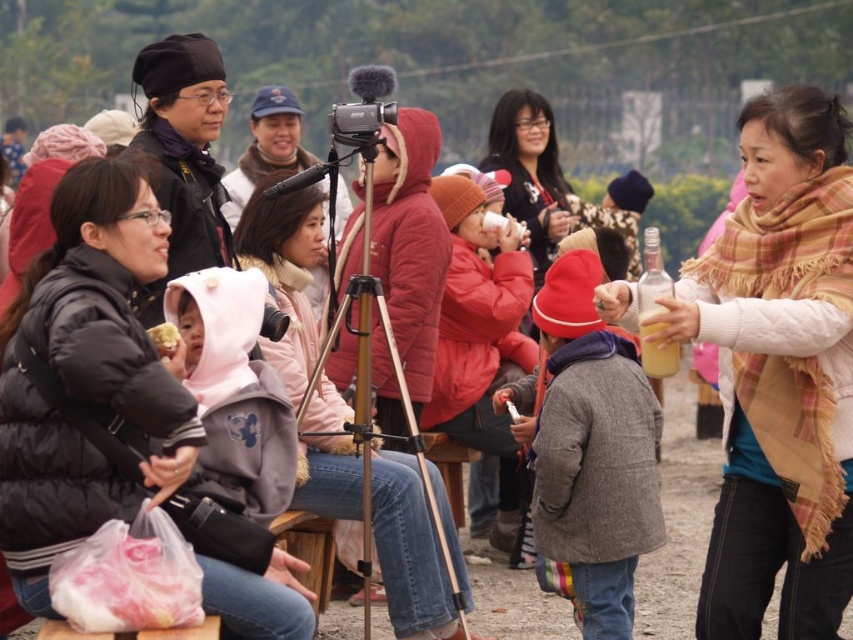
Question: Considering the real-world distances, which object is farthest from the black puffy jacket at left?

Choices:
 (A) black matte tripod at center
 (B) yellow matte cake at center
 (C) black matte video camera at center
 (D) plaid scarf at center

Answer: (D)

Question: Which object appears farthest from the camera in this image?

Choices:
 (A) black matte tripod at center
 (B) black puffy jacket at left
 (C) black matte video camera at center

Answer: (A)

Question: Observing the image, what is the correct spatial positioning of black matte video camera at center in reference to yellow matte cake at center?

Choices:
 (A) below
 (B) above

Answer: (B)

Question: Which point appears closest to the camera in this image?

Choices:
 (A) [165, 323]
 (B) [848, 477]
 (C) [379, 173]
 (D) [245, 570]

Answer: (D)

Question: Is plaid scarf at center wider than black matte video camera at center?

Choices:
 (A) no
 (B) yes

Answer: (B)

Question: Can you confirm if black puffy jacket at left is wider than black matte video camera at center?

Choices:
 (A) yes
 (B) no

Answer: (A)